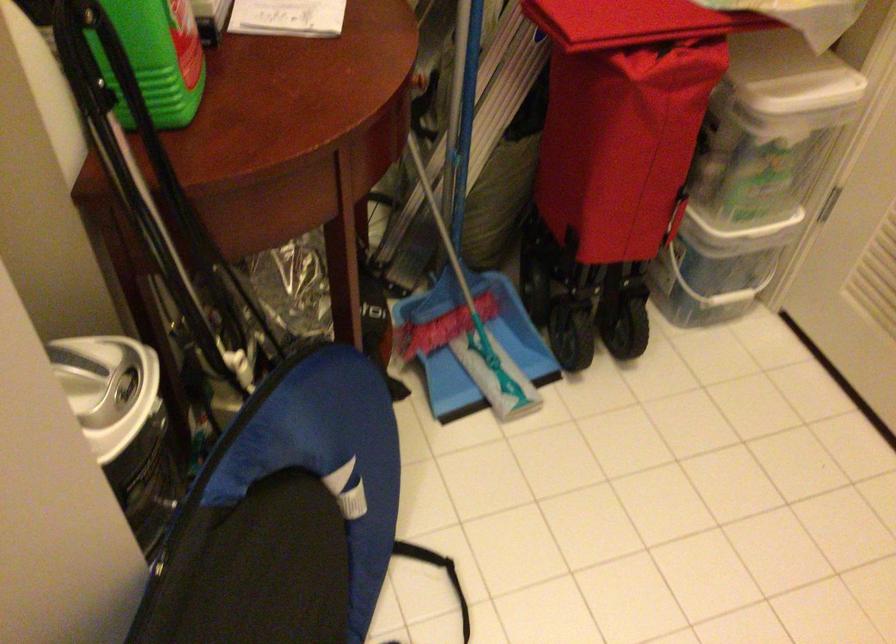
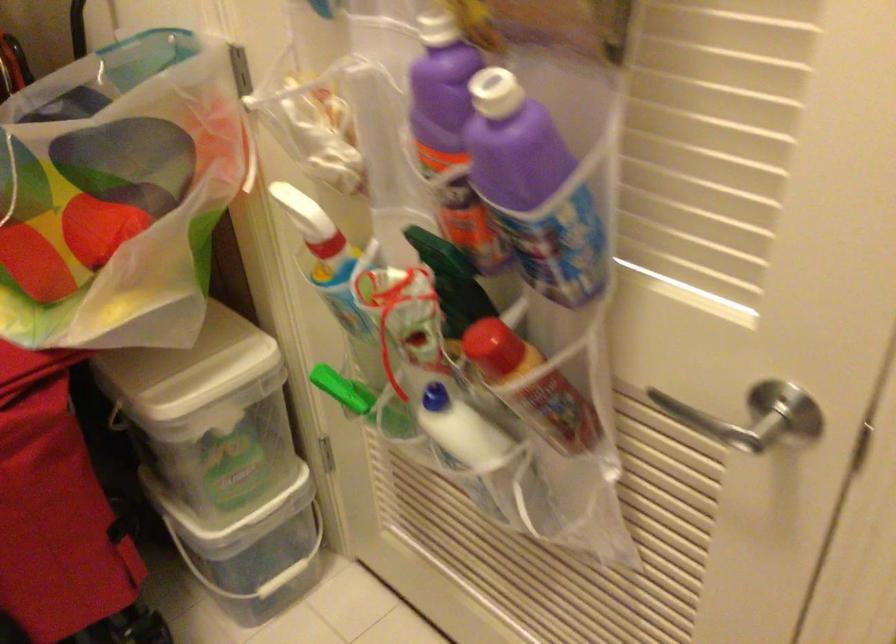
Question: The camera is either moving clockwise (left) or counter-clockwise (right) around the object. The first image is from the beginning of the video and the second image is from the end. Is the camera moving left or right when shooting the video?

Choices:
 (A) Left
 (B) Right

Answer: (A)